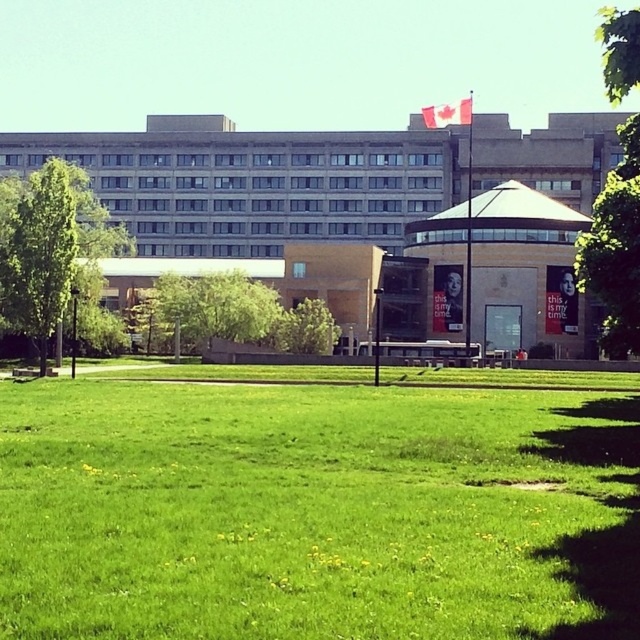
Question: Considering the relative positions of green leafy tree at left and green leafy tree at center in the image provided, where is green leafy tree at left located with respect to green leafy tree at center?

Choices:
 (A) above
 (B) below

Answer: (A)

Question: Which point is farther to the camera?

Choices:
 (A) (636, 20)
 (B) (61, 204)
 (C) (291, 589)
 (D) (324, 324)

Answer: (D)

Question: Which point is closer to the camera taking this photo?

Choices:
 (A) (314, 324)
 (B) (12, 214)
 (C) (621, 172)
 (D) (340, 369)

Answer: (C)

Question: Can you confirm if green leafy tree at left is positioned below green leafy tree at center?

Choices:
 (A) no
 (B) yes

Answer: (A)

Question: Can you confirm if green leafy tree at left is wider than green leafy tree at center?

Choices:
 (A) yes
 (B) no

Answer: (A)

Question: Estimate the real-world distances between objects in this image. Which object is farther from the green leafy tree at upper right?

Choices:
 (A) green leafy tree at center
 (B) green leafy tree at left
 (C) green grass at center

Answer: (B)